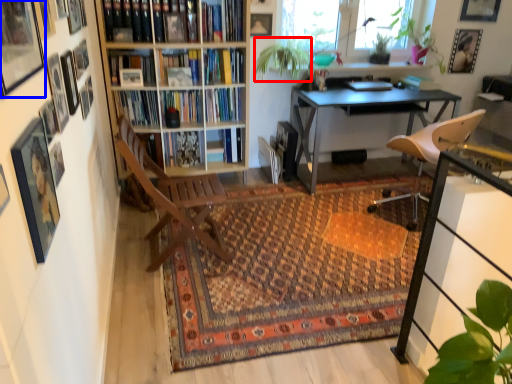
Question: Which object appears closest to the camera in this image, plant (highlighted by a red box) or picture frame (highlighted by a blue box)?

Choices:
 (A) plant
 (B) picture frame

Answer: (B)